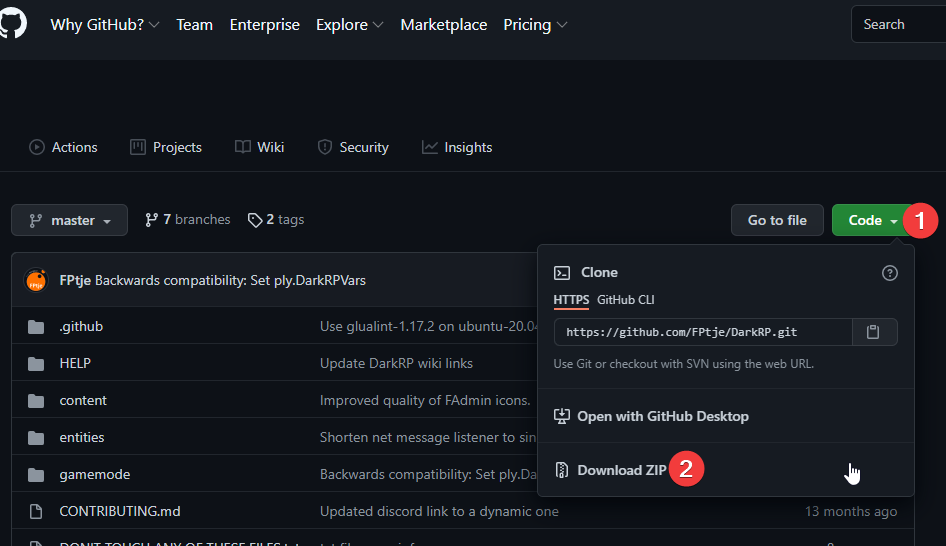
What are the coordinates of `folders` in the screenshot? It's located at (32, 325), (32, 362), (34, 399), (34, 434), (34, 467), (32, 507), (40, 541).